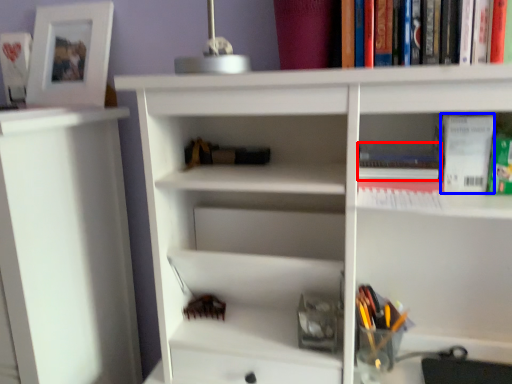
Question: Which object appears closest to the camera in this image, book (highlighted by a red box) or paperback book (highlighted by a blue box)?

Choices:
 (A) book
 (B) paperback book

Answer: (B)